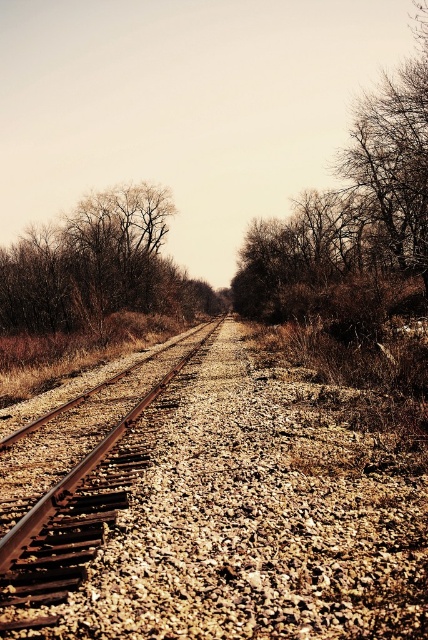
From the picture: You are an engineer inspecting the railway tracks. You notice the bare branches at upper left and the rusty metal train track at center. Which object is closer to the viewer?

The bare branches at upper left are closer to the viewer because they are positioned over the rusty metal train track at center, indicating they are in a forward plane in the visual hierarchy.

You are standing at the starting point of the railway track and see a point marked at coordinates (350, 208). What is located at that point?

The point at coordinates (350, 208) corresponds to bare branches at center.